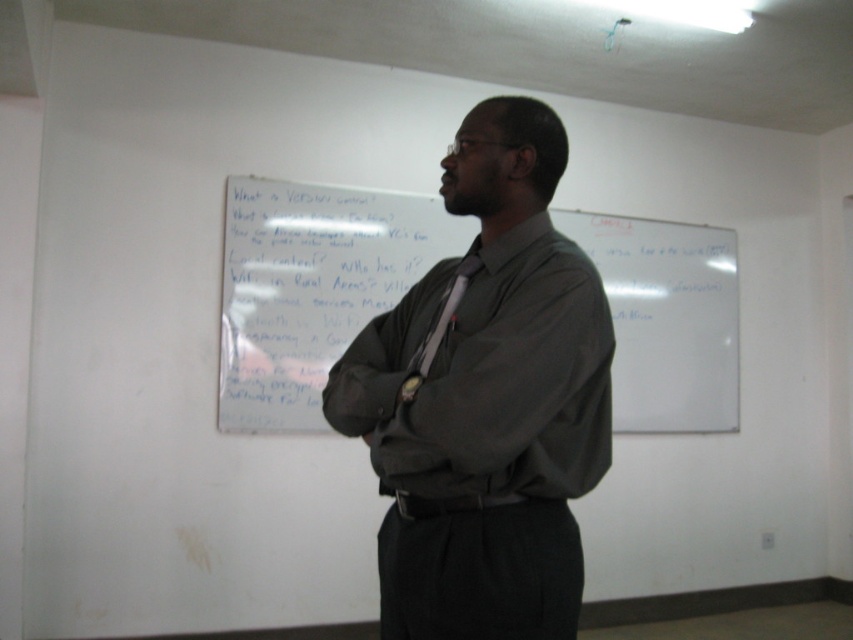
Where is the whiteboard at center located in the image?

The whiteboard at center is located at point (311, 288).

You are an interior designer assessing the classroom layout. The whiteboard at center and the matte black tie at center are both in your view. Which object is taller?

The whiteboard at center is much taller than the matte black tie at center.

You are a fashion designer analyzing the man in the image. You need to determine if the dark gray shirt at center and the matte black tie at center can be worn together based on their size. Which one is bigger?

The dark gray shirt at center has a larger size compared to matte black tie at center, so they can be worn together as the shirt is bigger than the tie.